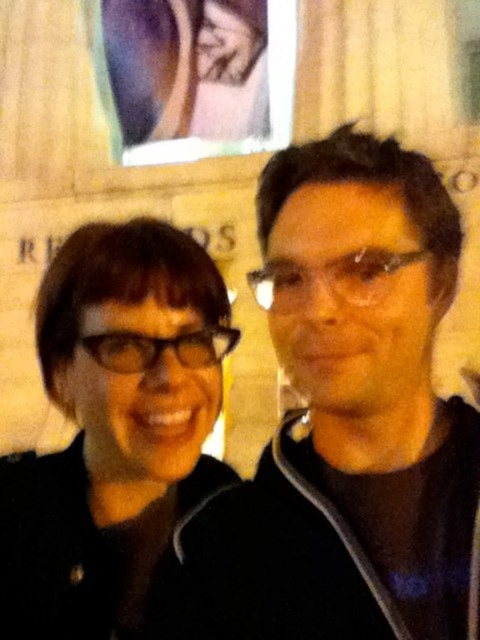
Can you confirm if black matte glasses at left is thinner than black plastic glasses at center?

In fact, black matte glasses at left might be wider than black plastic glasses at center.

Does point (153, 552) come in front of point (204, 344)?

Yes.

Who is more distant from viewer, (48, 376) or (183, 352)?

The point (48, 376) is behind.

I want to click on black matte glasses at left, so click(x=117, y=436).

Between matte black glasses at center and black plastic glasses at center, which one is positioned higher?

matte black glasses at center is higher up.

Does matte black glasses at center have a greater width compared to black plastic glasses at center?

No, matte black glasses at center is not wider than black plastic glasses at center.

Does point (310, 280) come closer to viewer compared to point (152, 364)?

Yes, it is.

At what (x,y) coordinates should I click in order to perform the action: click on matte black glasses at center. Please return your answer as a coordinate pair (x, y). The image size is (480, 640). Looking at the image, I should click on (327, 278).

Which is below, black matte glasses at left or matte black glasses at center?

black matte glasses at left is lower down.

Who is more distant from viewer, (113, 413) or (380, 259)?

Positioned behind is point (113, 413).

At what (x,y) coordinates should I click in order to perform the action: click on black matte glasses at left. Please return your answer as a coordinate pair (x, y). Looking at the image, I should click on (117, 436).